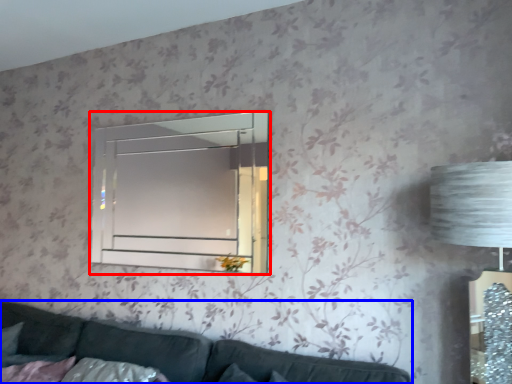
Question: Among these objects, which one is nearest to the camera, window (highlighted by a red box) or studio couch (highlighted by a blue box)?

Choices:
 (A) window
 (B) studio couch

Answer: (B)